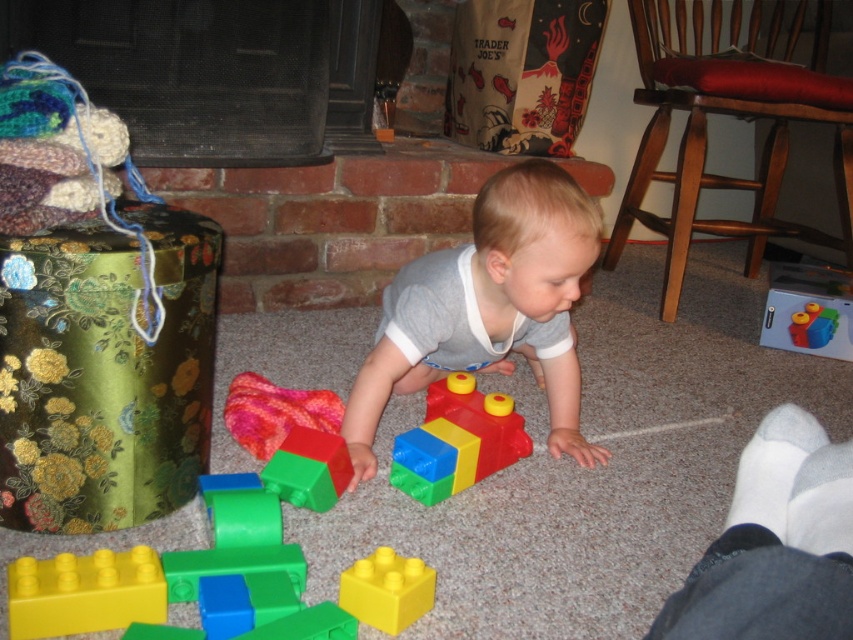
Question: Which is nearer to the smooth plastic blocks at center?

Choices:
 (A) yellow matte plastic block at lower left
 (B) yellow matte plastic block at center

Answer: (B)

Question: Observing the image, what is the correct spatial positioning of yellow matte plastic block at center in reference to bright blue plastic blocks at center?

Choices:
 (A) above
 (B) below

Answer: (B)

Question: Does yellow matte plastic block at lower left have a greater width compared to rubberized plastic building block at center?

Choices:
 (A) no
 (B) yes

Answer: (A)

Question: Among these points, which one is nearest to the camera?

Choices:
 (A) (16, 625)
 (B) (410, 579)
 (C) (490, 404)

Answer: (A)

Question: Which object is farther from the camera taking this photo?

Choices:
 (A) bright blue plastic blocks at center
 (B) yellow matte plastic block at center

Answer: (A)

Question: Does smooth plastic blocks at center have a lesser width compared to rubberized plastic blocks at center?

Choices:
 (A) no
 (B) yes

Answer: (A)